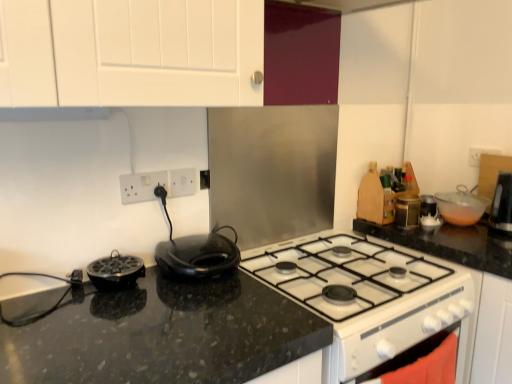
Locate an element on the screen. free location in front of white frosted glass jar at upper right is located at coordinates (452, 239).